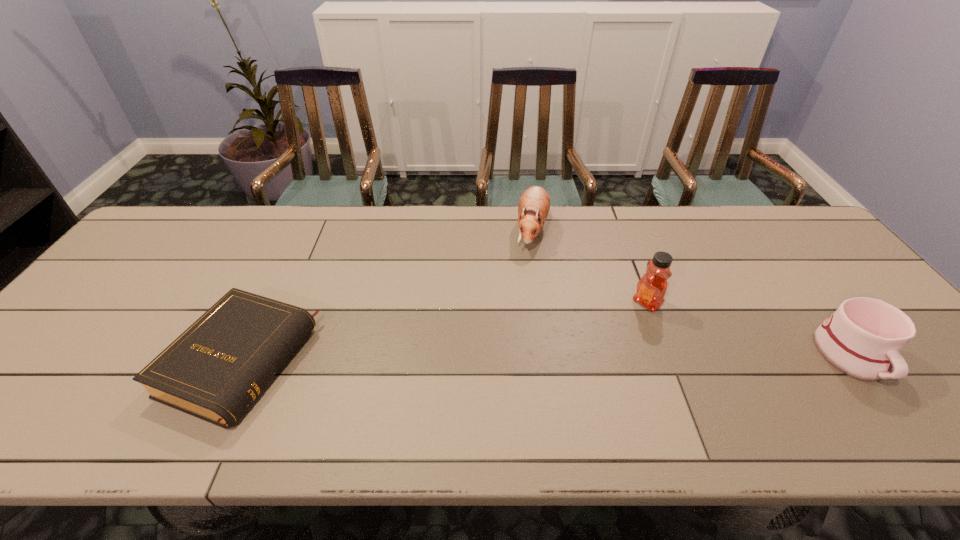
Identify the location of free space located 0.110m at the face of the third object from right to left. (519, 279).

Find the location of a particular element. vacant space positioned 0.310m at the face of the third object from right to left is located at coordinates (497, 330).

In order to click on free space located 0.330m at the face of the third object from right to left in this screenshot , I will do `click(495, 336)`.

The image size is (960, 540). In order to click on object that is at the far edge in this screenshot , I will do `click(534, 204)`.

Locate an element on the screen. Bible at the near edge is located at coordinates (215, 369).

At what (x,y) coordinates should I click in order to perform the action: click on mug that is at the near edge. Please return your answer as a coordinate pair (x, y). This screenshot has width=960, height=540. Looking at the image, I should click on (863, 339).

Locate an element on the screen. object located in the right edge section of the desktop is located at coordinates (863, 339).

I want to click on object that is at the near right corner, so click(863, 339).

Locate an element on the screen. The image size is (960, 540). vacant space at the far edge is located at coordinates (321, 242).

Locate an element on the screen. vacant space at the near edge is located at coordinates (762, 375).